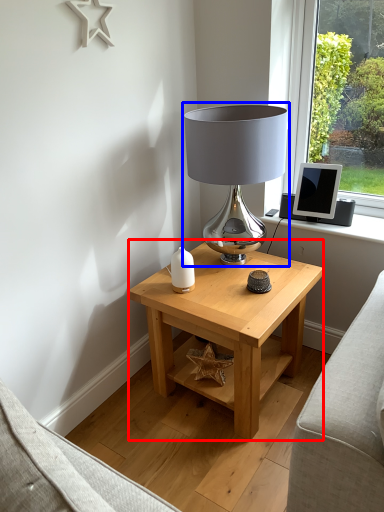
Question: Among these objects, which one is nearest to the camera, table (highlighted by a red box) or lamp (highlighted by a blue box)?

Choices:
 (A) table
 (B) lamp

Answer: (A)